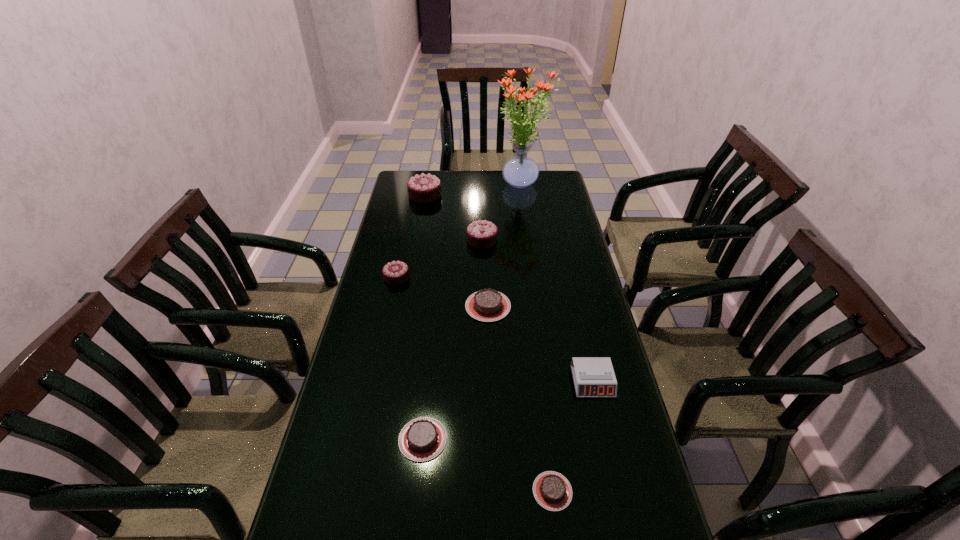
You are a GUI agent. You are given a task and a screenshot of the screen. Output one action in this format:
    pyautogui.click(x=<x>, y=<y>)
    Task: Click on the seventh closest object to the shortest chocolate cake
    
    Given the screenshot: What is the action you would take?
    pyautogui.click(x=520, y=171)

Select which object appears as the second closest to the farthest chocolate chocolate cake. Please provide its 2D coordinates. Your answer should be formatted as a tuple, i.e. [(x, y)], where the tuple contains the x and y coordinates of a point satisfying the conditions above.

[(520, 171)]

Identify which chocolate cake is the third closest to the rightmost chocolate chocolate cake. Please provide its 2D coordinates. Your answer should be formatted as a tuple, i.e. [(x, y)], where the tuple contains the x and y coordinates of a point satisfying the conditions above.

[(425, 188)]

Point out which chocolate cake is positioned as the fourth nearest to the second smallest chocolate chocolate cake. Please provide its 2D coordinates. Your answer should be formatted as a tuple, i.e. [(x, y)], where the tuple contains the x and y coordinates of a point satisfying the conditions above.

[(422, 439)]

Select which chocolate chocolate cake is the closest to the leftmost brown chocolate cake. Please provide its 2D coordinates. Your answer should be formatted as a tuple, i.e. [(x, y)], where the tuple contains the x and y coordinates of a point satisfying the conditions above.

[(396, 272)]

Choose which chocolate chocolate cake is the third nearest neighbor to the sixth farthest object. Please provide its 2D coordinates. Your answer should be formatted as a tuple, i.e. [(x, y)], where the tuple contains the x and y coordinates of a point satisfying the conditions above.

[(425, 188)]

Choose which brown chocolate cake is the third nearest neighbor to the farthest chocolate chocolate cake. Please provide its 2D coordinates. Your answer should be formatted as a tuple, i.e. [(x, y)], where the tuple contains the x and y coordinates of a point satisfying the conditions above.

[(552, 491)]

Select which brown chocolate cake appears as the third closest to the fourth nearest chocolate cake. Please provide its 2D coordinates. Your answer should be formatted as a tuple, i.e. [(x, y)], where the tuple contains the x and y coordinates of a point satisfying the conditions above.

[(552, 491)]

The image size is (960, 540). Identify the location of vacant point that satisfies the following two spatial constraints: 1. on the front side of the flower arrangement; 2. on the right side of the sixth farthest object. (551, 381).